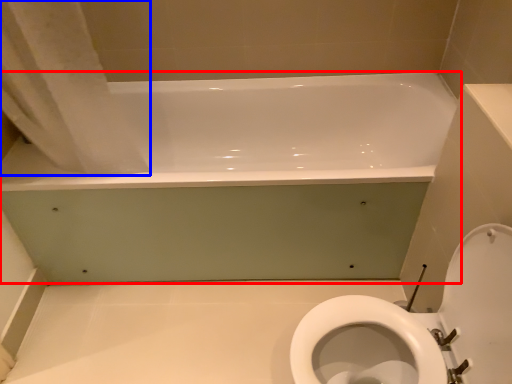
Question: Which of the following is the closest to the observer, bathtub (highlighted by a red box) or shower curtain (highlighted by a blue box)?

Choices:
 (A) bathtub
 (B) shower curtain

Answer: (B)